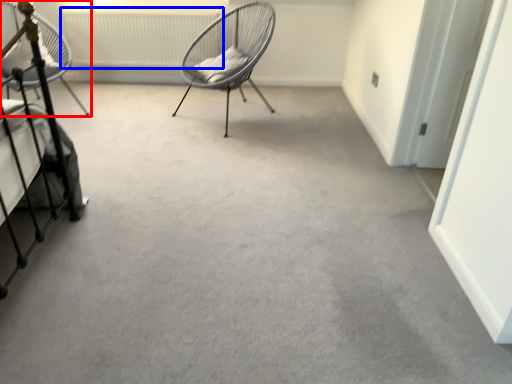
Question: Which of the following is the closest to the observer, chair (highlighted by a red box) or radiator (highlighted by a blue box)?

Choices:
 (A) chair
 (B) radiator

Answer: (A)